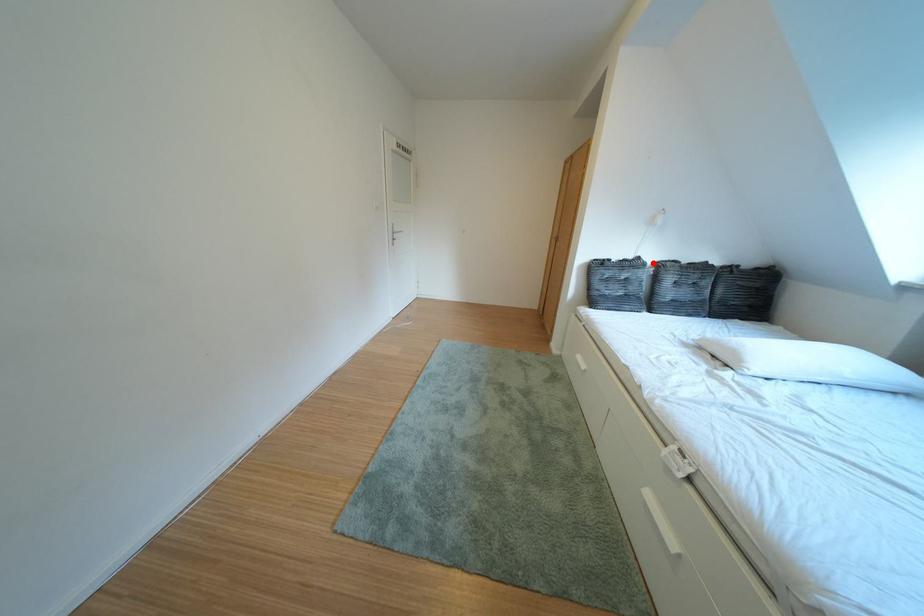
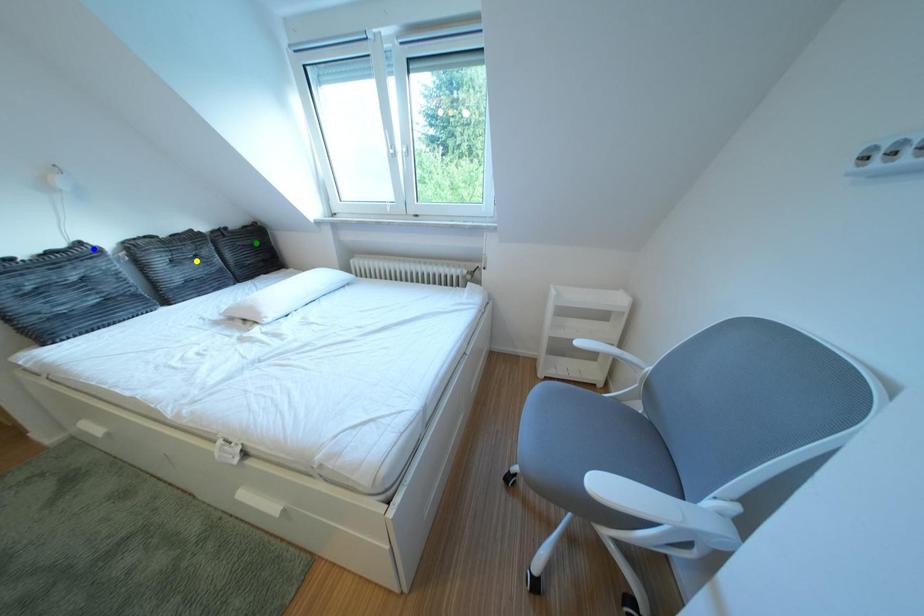
Question: I am providing you with two images of the same scene from different viewpoints. A red point is marked on the first image. You are given multiple points on the second image. In image 2, which mark is for the same physical point as the one in image 1?

Choices:
 (A) blue point
 (B) yellow point
 (C) green point

Answer: (A)